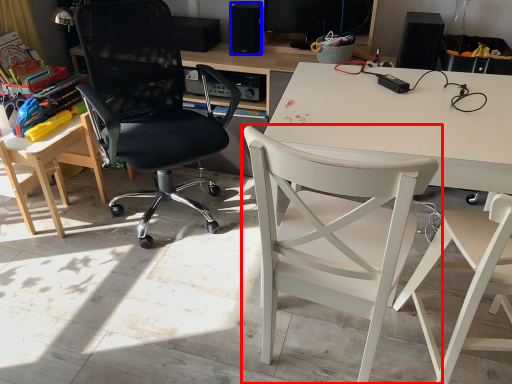
Question: Which of the following is the closest to the observer, chair (highlighted by a red box) or loudspeaker (highlighted by a blue box)?

Choices:
 (A) chair
 (B) loudspeaker

Answer: (A)